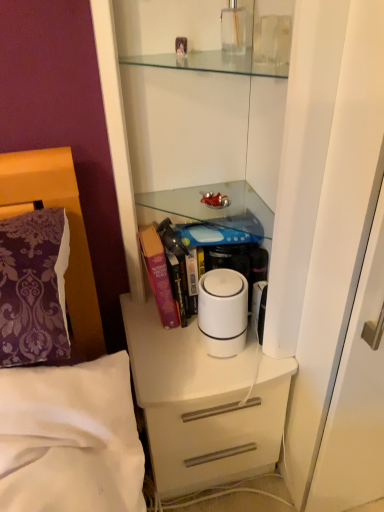
Question: Is white matte chest of drawers at center inside or outside of purple hardcover book at center?

Choices:
 (A) inside
 (B) outside

Answer: (B)

Question: From their relative heights in the image, would you say white matte chest of drawers at center is taller or shorter than purple hardcover book at center?

Choices:
 (A) tall
 (B) short

Answer: (A)

Question: Which is nearer to the white plastic humidifier at center?

Choices:
 (A) white matte chest of drawers at center
 (B) purple hardcover book at center

Answer: (B)

Question: Based on their relative distances, which object is nearer to the white matte chest of drawers at center?

Choices:
 (A) purple hardcover book at center
 (B) white plastic humidifier at center

Answer: (B)